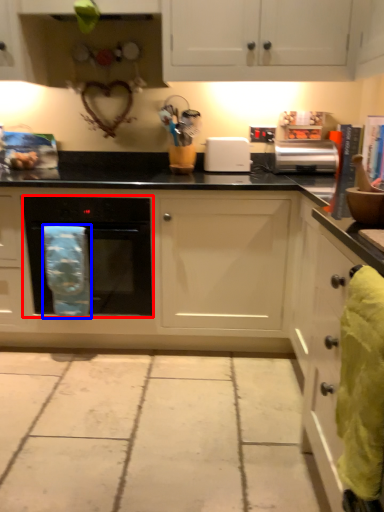
Question: Which point is further to the camera, home appliance (highlighted by a red box) or material (highlighted by a blue box)?

Choices:
 (A) home appliance
 (B) material

Answer: (A)